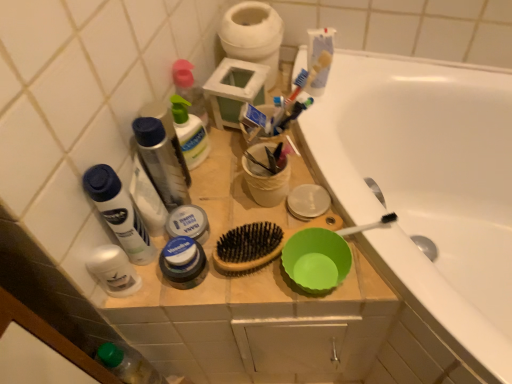
The image size is (512, 384). I want to click on free spot in front of white matte tube at upper right, which is the second toothpaste from bottom to top, so click(x=326, y=146).